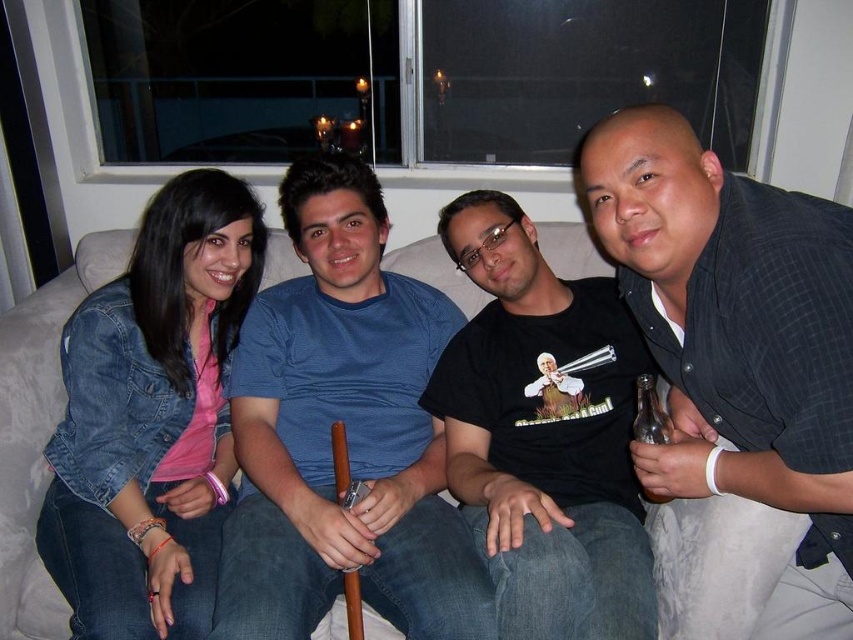
You are looking at the image of the four people sitting on the couch. Where exactly is the blue cotton shirt at center located in the image?

The blue cotton shirt at center is located at point coordinates of 0.677 on the x axis and 0.406 on the y axis.

You are a photographer setting up a shoot in the living room. You need to ensure that the dark gray checkered shirt at right and the white fabric couch at center are both visible in the frame. Based on their positions, which object is covering part of the other?

The dark gray checkered shirt at right is positioned over the white fabric couch at center, so it is covering part of the couch.

Based on the scene description, can you determine if the blue cotton shirt at center is wider than the white fabric couch at center?

The blue cotton shirt at center is wider than the white fabric couch at center according to the description.